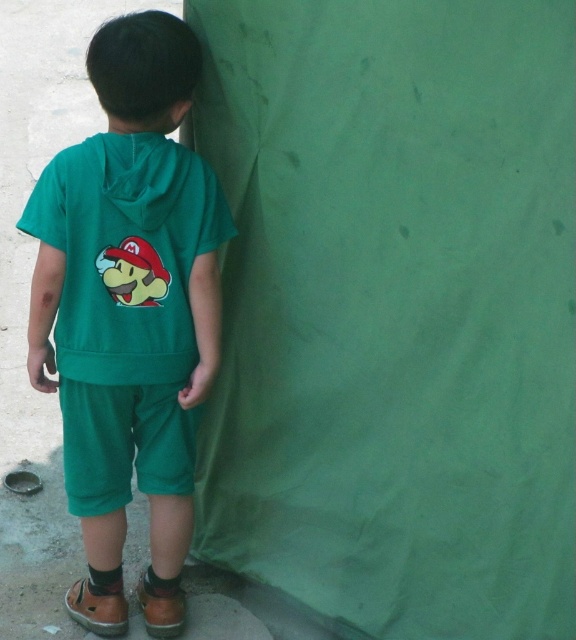
You are a photographer setting up a shoot with a matte green hoodie at center. The background is a large green fabric. To ensure the hoodie stands out, where should you position the hoodie relative to the background?

The matte green hoodie at center is located at point (130,312), so positioning it there will help it stand out against the green background by using the coordinates for optimal placement.

You are a photographer adjusting your camera to focus on two points in the scene. The first point is point (51, 252) and the second is point (82, 484). Since you can only focus on one point at a time, which point should you choose to ensure the foreground elements are sharp?

You should focus on point (51, 252) because it is closer to the viewer than point (82, 484), ensuring the foreground elements are in focus.